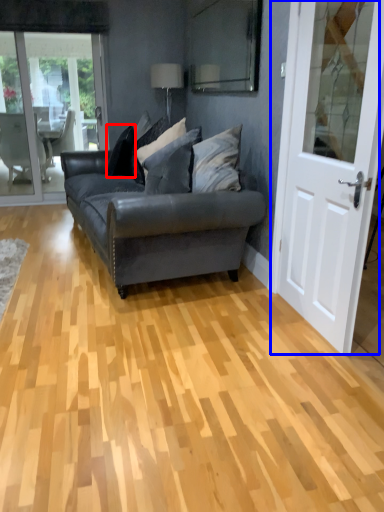
Question: Which of the following is the farthest to the observer, pillow (highlighted by a red box) or door (highlighted by a blue box)?

Choices:
 (A) pillow
 (B) door

Answer: (A)